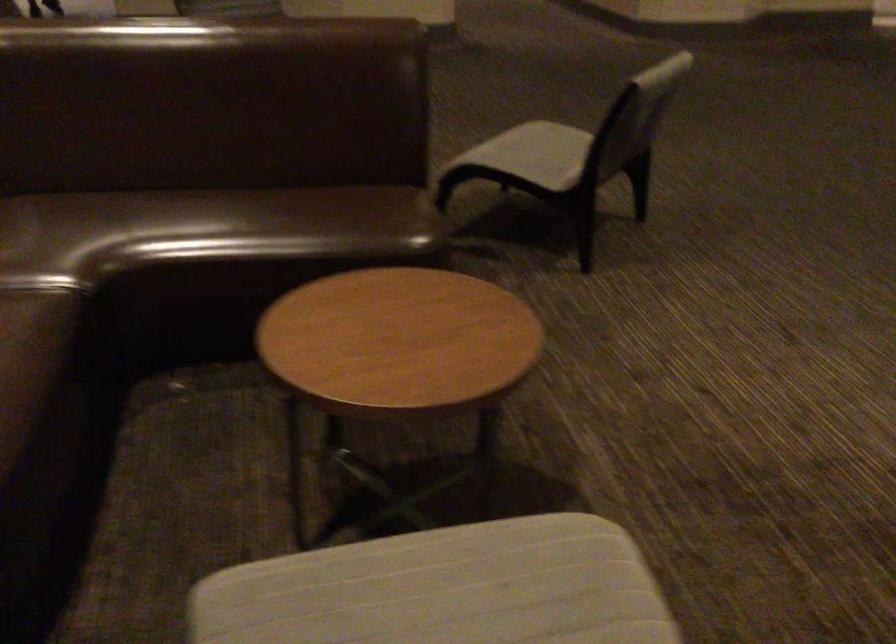
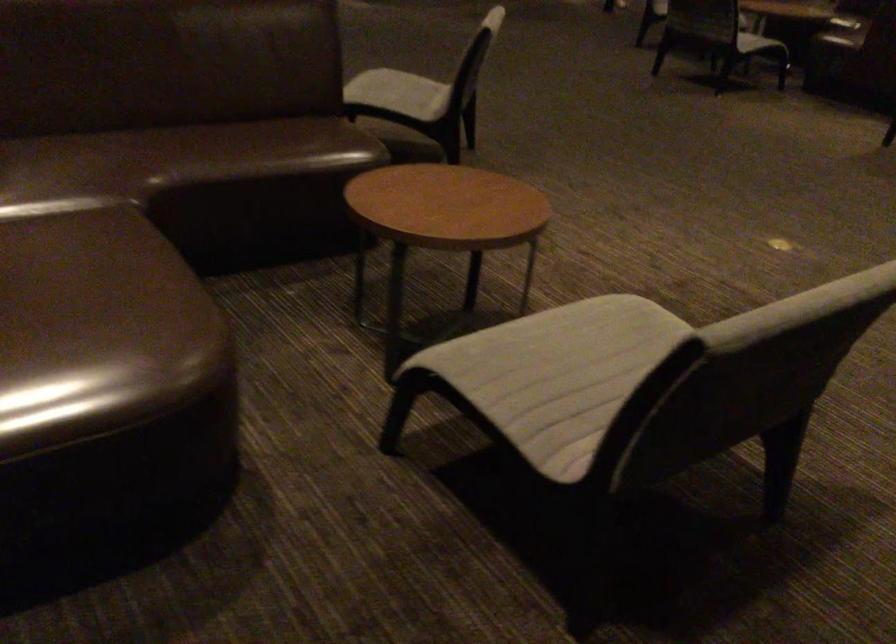
Question: How did the camera likely rotate?

Choices:
 (A) Left
 (B) Right
 (C) Up
 (D) Down

Answer: (B)